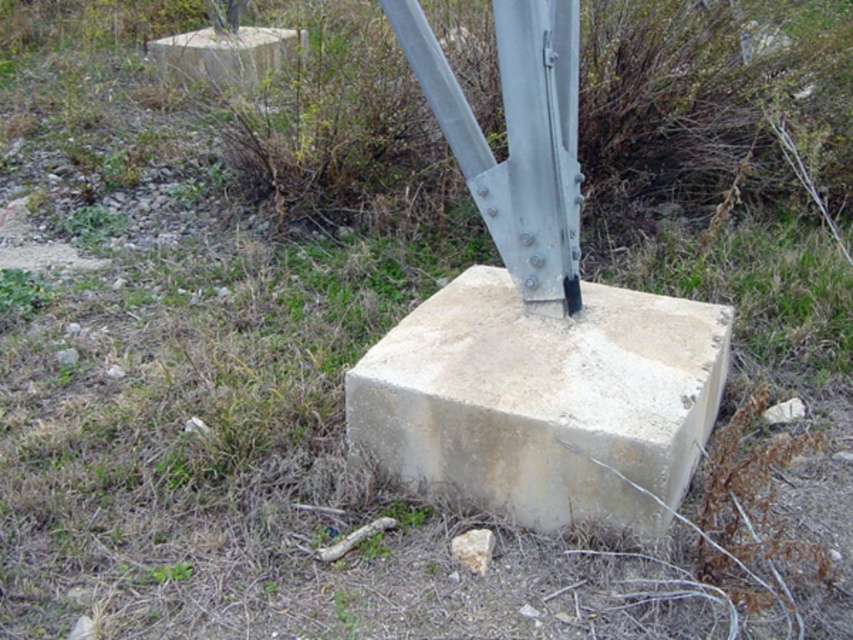
Who is more forward, (540, 477) or (184, 74)?

Point (540, 477)

Does light gray concrete block at center have a larger size compared to beige concrete block at upper left?

No.

The image size is (853, 640). Describe the element at coordinates (543, 403) in the screenshot. I see `light gray concrete block at center` at that location.

This screenshot has width=853, height=640. I want to click on light gray concrete block at center, so click(543, 403).